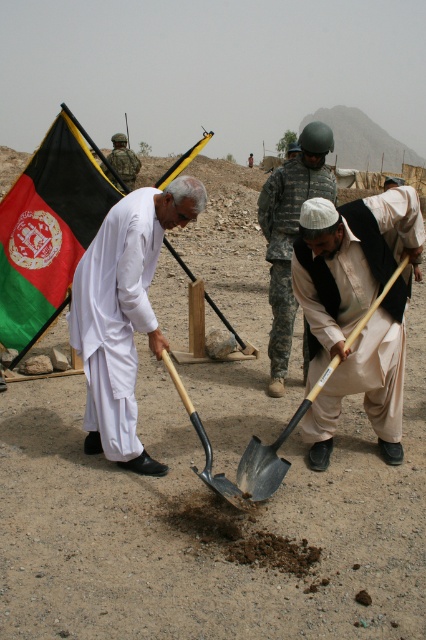
Does green and black fabric flag at upper left appear over black metal shovel at center?

Indeed, green and black fabric flag at upper left is positioned over black metal shovel at center.

What do you see at coordinates (48, 230) in the screenshot?
I see `green and black fabric flag at upper left` at bounding box center [48, 230].

Which is behind, point (68, 230) or point (328, 368)?

The point (68, 230) is more distant.

Where is `green and black fabric flag at upper left`? This screenshot has width=426, height=640. green and black fabric flag at upper left is located at coordinates (48, 230).

Is white cotton shirt at center taller than camouflage uniform at center?

Yes.

Between white cotton shirt at center and camouflage uniform at center, which one appears on the left side from the viewer's perspective?

Positioned to the left is white cotton shirt at center.

Measure the distance between point (x=299, y=198) and camera.

5.21 meters

Image resolution: width=426 pixels, height=640 pixels. I want to click on white cotton shirt at center, so click(x=290, y=234).

Can you confirm if green and black fabric flag at upper left is smaller than white cotton shirt at center?

Yes, green and black fabric flag at upper left is smaller than white cotton shirt at center.

Which is behind, point (39, 282) or point (279, 284)?

Point (39, 282)

This screenshot has height=640, width=426. I want to click on green and black fabric flag at upper left, so click(x=48, y=230).